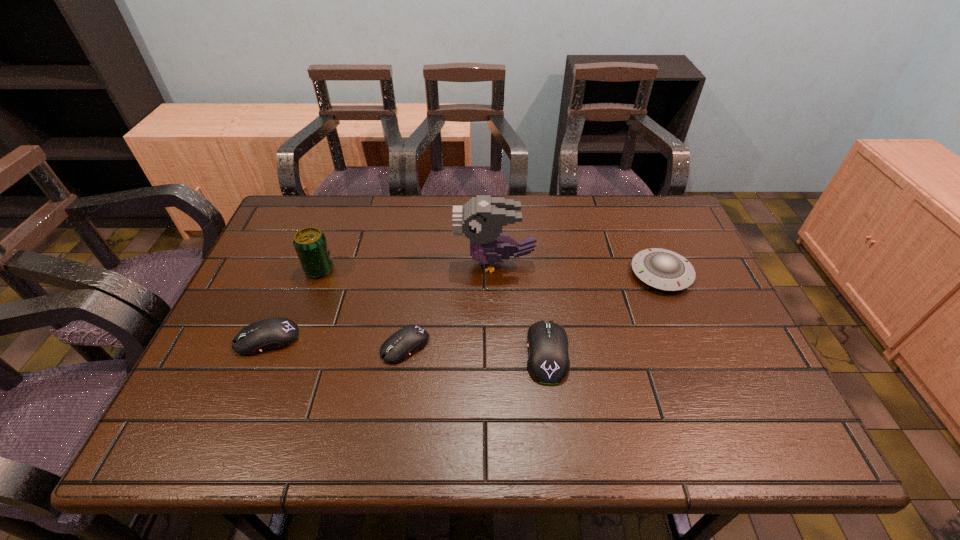
I want to click on vacant space that satisfies the following two spatial constraints: 1. on the front side of the beer can; 2. on the left side of the saucer, so click(x=318, y=274).

Find the location of a particular element. Image resolution: width=960 pixels, height=540 pixels. free spot that satisfies the following two spatial constraints: 1. at the beak of the rightmost computer equipment; 2. on the right side of the bird is located at coordinates (498, 353).

Identify the location of free space that satisfies the following two spatial constraints: 1. at the beak of the rightmost object; 2. on the right side of the tallest object. (495, 274).

The height and width of the screenshot is (540, 960). In order to click on free point that satisfies the following two spatial constraints: 1. at the beak of the tallest object; 2. on the left side of the rightmost computer equipment in this screenshot , I will do `click(498, 353)`.